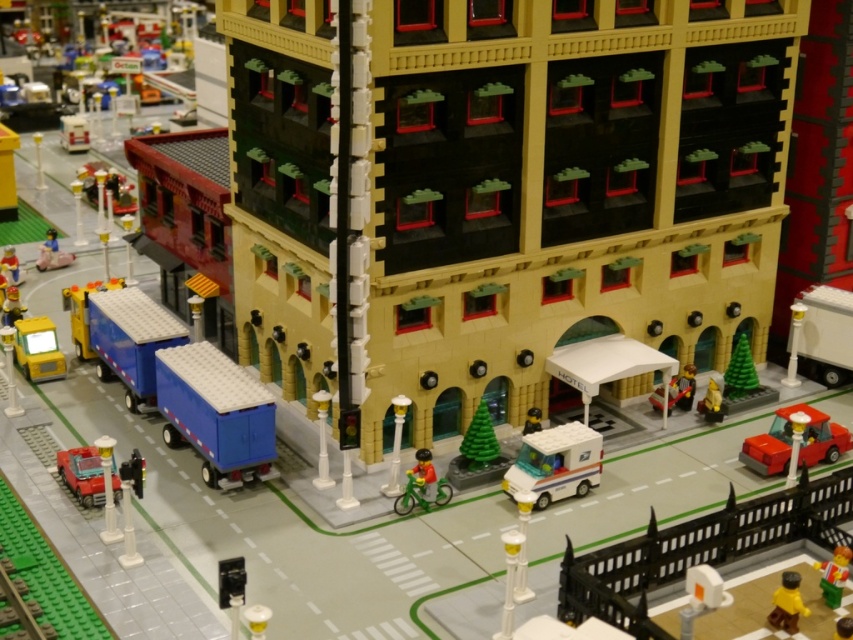
You are standing at the camera position looking at the Lego cityscape. There is a point marked at coordinates [801,448] in the image. If you want to place a new Lego tree exactly at that point, how far in meters should you place it from your current position?

The point at coordinates [801,448] is 14.59 meters away from the camera. Therefore, you should place the new Lego tree exactly 14.59 meters away from your current position at that point.

You are a Lego figure standing at the smooth yellow figure at center. You want to move to the red plastic car at lower right. Which direction should you go?

The red plastic car at lower right is to the right of the smooth yellow figure at center, so you should move to the right to reach it.